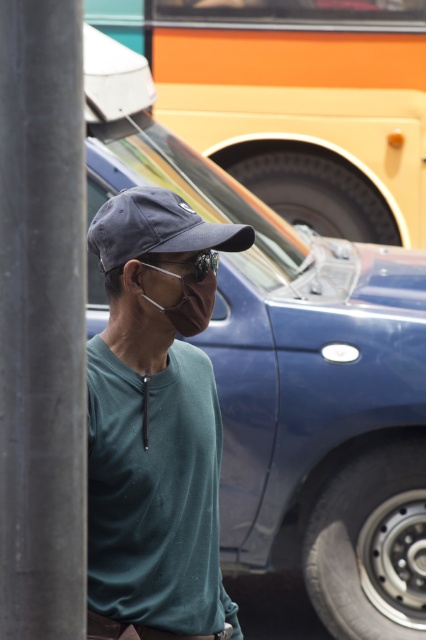
Between point (210, 246) and point (215, 264), which one is positioned in front?

Point (210, 246) is more forward.

Who is positioned more to the left, dark blue fabric baseball cap at center or clear plastic goggles at center?

dark blue fabric baseball cap at center is more to the left.

Is point (143, 202) positioned behind point (180, 262)?

No, (143, 202) is closer to viewer.

Locate an element on the screen. The height and width of the screenshot is (640, 426). dark blue fabric baseball cap at center is located at coordinates (157, 227).

Which is in front, point (48, 102) or point (181, 252)?

Point (48, 102) is more forward.

Where is `smooth gray pole at left`? The image size is (426, 640). smooth gray pole at left is located at coordinates (42, 321).

Find the location of a particular element. This screenshot has width=426, height=640. smooth gray pole at left is located at coordinates (42, 321).

Does point (180, 294) come closer to viewer compared to point (19, 186)?

No, (180, 294) is further to viewer.

Does matte green shirt at center appear under smooth gray pole at left?

Yes, matte green shirt at center is below smooth gray pole at left.

At what (x,y) coordinates should I click in order to perform the action: click on matte green shirt at center. Please return your answer as a coordinate pair (x, y). Looking at the image, I should click on (155, 426).

Image resolution: width=426 pixels, height=640 pixels. Identify the location of matte green shirt at center. (155, 426).